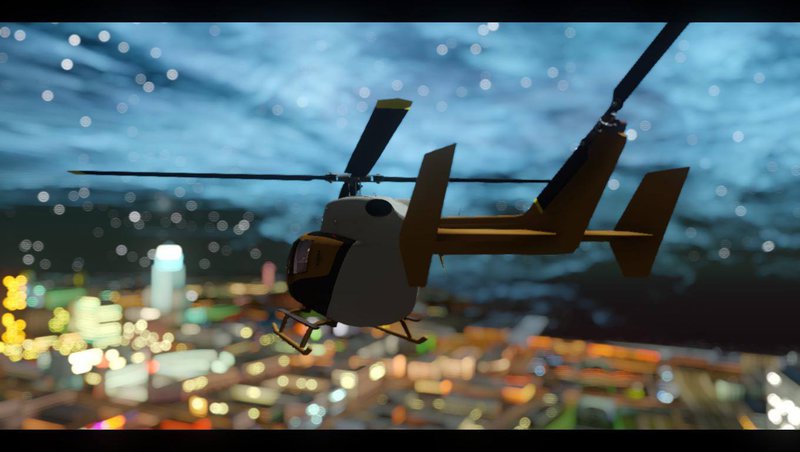
Locate an element on the screen. The width and height of the screenshot is (800, 452). yellow light is located at coordinates (14, 332), (18, 286).